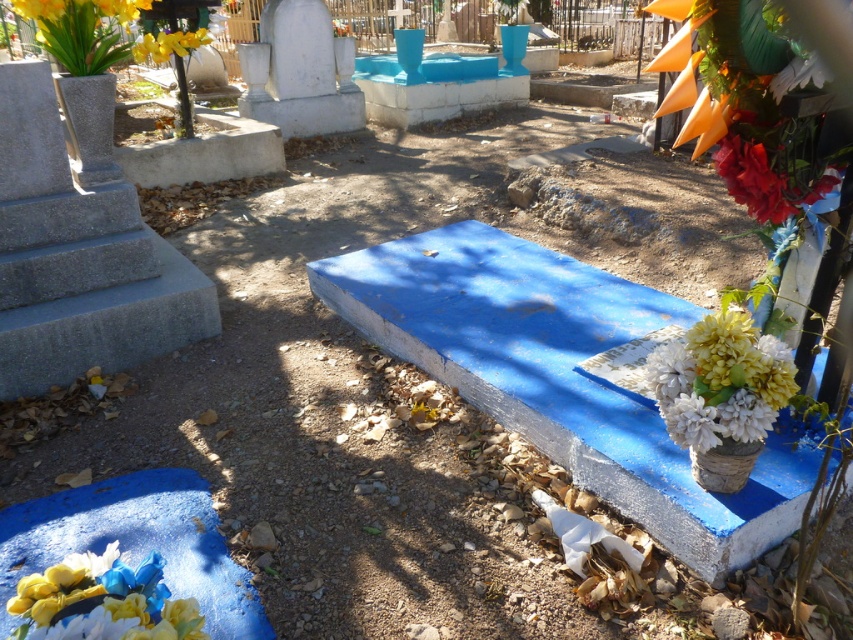
You are a gardener tasked with watering the red matte flower at upper right and the yellow matte flowers at upper left. Which flower should you water first if you want to start from the one closer to the ground?

The red matte flower at upper right should be watered first because it is positioned under the yellow matte flowers at upper left, meaning it is closer to the ground.

You are a groundskeeper tasked with watering the white matte flowers at center right in the cemetery. You have a watering can and need to approach them from the path that runs along the left side of the image. Based on their position, can you estimate whether you should walk towards the upper or lower part of the image to reach them?

The white matte flowers at center right are located at point (720, 381), which places them in the upper portion of the image. Therefore, you should walk towards the upper part of the image to reach them.

You are standing at the entrance of the cemetery and want to place a new bouquet exactly where the matte floral bouquet at lower left is currently located. What are the coordinates of that location?

The coordinates of the matte floral bouquet at lower left are at point [102,602].